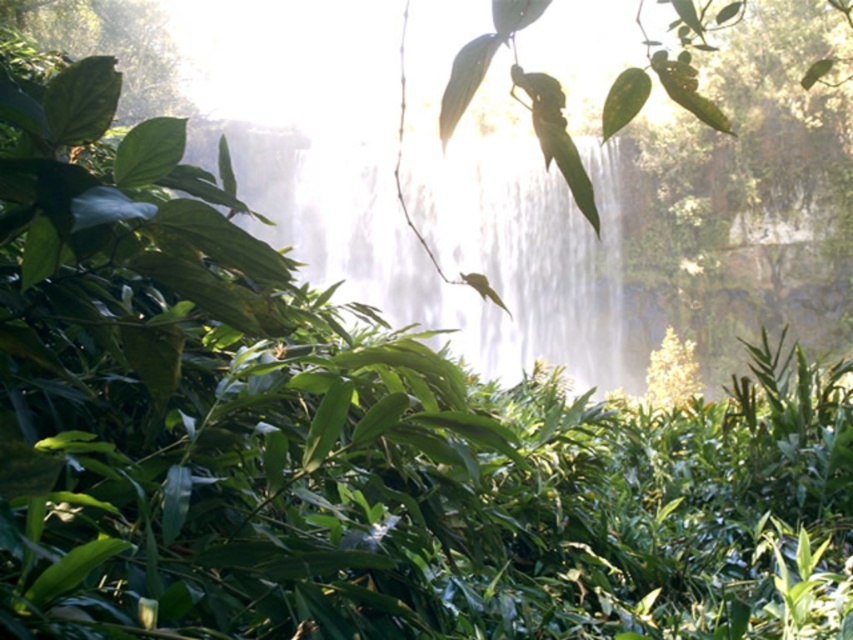
Is white misty waterfall at center closer to camera compared to green leafy plant at upper left?

That is False.

Can you confirm if white misty waterfall at center is wider than green leafy plant at upper left?

Correct, the width of white misty waterfall at center exceeds that of green leafy plant at upper left.

Where is `white misty waterfall at center`? white misty waterfall at center is located at coordinates (471, 248).

This screenshot has width=853, height=640. I want to click on white misty waterfall at center, so click(x=471, y=248).